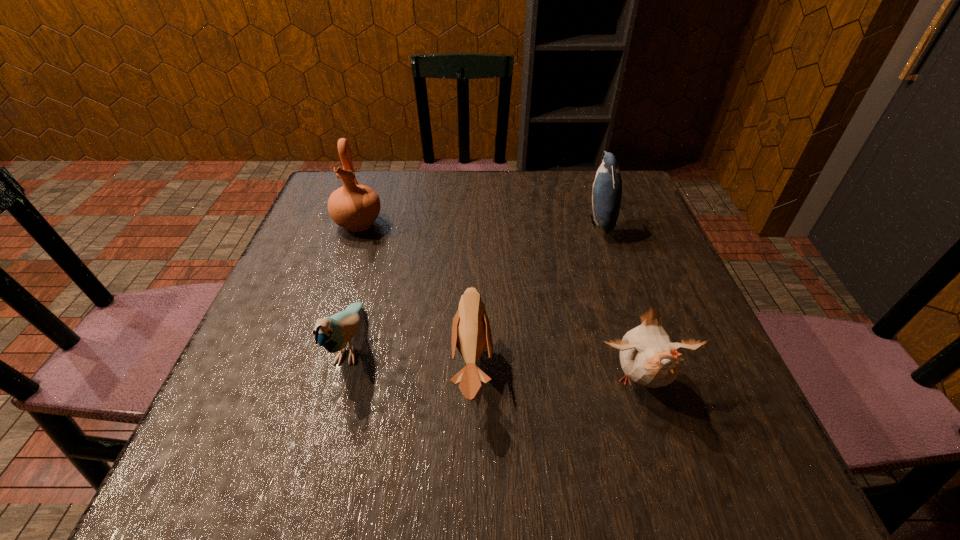
Where is `vacant region at the right edge of the desktop`? The height and width of the screenshot is (540, 960). vacant region at the right edge of the desktop is located at coordinates (695, 319).

Where is `vacant space at the far left corner`? Image resolution: width=960 pixels, height=540 pixels. vacant space at the far left corner is located at coordinates (377, 189).

Locate an element on the screen. vacant area between the farthest bird and the third object from left to right is located at coordinates (536, 295).

Locate an element on the screen. free space between the farthest bird and the leftmost bird is located at coordinates (474, 285).

Where is `empty location between the leftmost bird and the farthest bird`? empty location between the leftmost bird and the farthest bird is located at coordinates (474, 285).

Identify the location of free space between the pottery and the leftmost bird. Image resolution: width=960 pixels, height=540 pixels. (354, 285).

Locate an element on the screen. The width and height of the screenshot is (960, 540). empty location between the pottery and the farthest bird is located at coordinates (479, 223).

Identify the location of unoccupied position between the pottery and the shortest bird. The width and height of the screenshot is (960, 540). (416, 295).

What are the coordinates of `vacant space in between the second bird from left to right and the pottery` in the screenshot? It's located at (416, 295).

Locate an element on the screen. The image size is (960, 540). object that is the second nearest to the leftmost bird is located at coordinates (x=355, y=207).